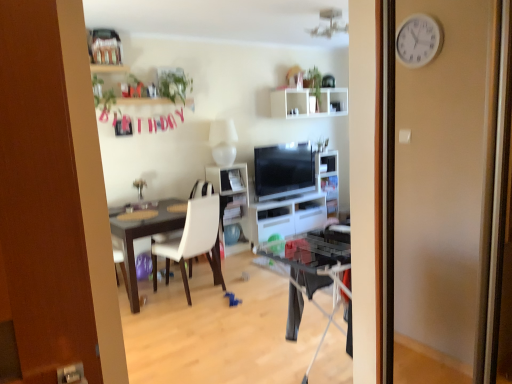
Describe the element at coordinates (174, 85) in the screenshot. I see `green leafy plant at upper center` at that location.

The height and width of the screenshot is (384, 512). What do you see at coordinates (286, 217) in the screenshot?
I see `white glossy cabinet at center` at bounding box center [286, 217].

Image resolution: width=512 pixels, height=384 pixels. What do you see at coordinates (284, 170) in the screenshot?
I see `matte black tv at center` at bounding box center [284, 170].

I want to click on white matte shelf at upper center, arranged as the first shelf when viewed from the back, so click(308, 103).

At what (x,y) coordinates should I click in order to perform the action: click on cabinetry on the left of white matte shelf at upper center, the second shelf viewed from the front. Please return your answer as a coordinate pair (x, y). The height and width of the screenshot is (384, 512). Looking at the image, I should click on (286, 217).

Is white glossy cabinet at center directly adjacent to white matte shelf at upper center, placed as the 1th shelf when sorted from top to bottom?

No, white glossy cabinet at center is not in contact with white matte shelf at upper center, placed as the 1th shelf when sorted from top to bottom.

From a real-world perspective, is white glossy cabinet at center located higher than white matte shelf at upper center, arranged as the first shelf when viewed from the back?

No, from a real-world perspective, white glossy cabinet at center is not above white matte shelf at upper center, arranged as the first shelf when viewed from the back.

From the image's perspective, between green leafy plant at upper center and matte black tv at center, who is located below?

matte black tv at center is shown below in the image.

Is green leafy plant at upper center positioned with its back to matte black tv at center?

green leafy plant at upper center does not have its back to matte black tv at center.

The width and height of the screenshot is (512, 384). I want to click on plant that appears above the matte black tv at center (from the image's perspective), so click(x=174, y=85).

From a real-world perspective, relative to matte black tv at center, is green leafy plant at upper center vertically above or below?

green leafy plant at upper center is situated higher than matte black tv at center in the real world.

How many degrees apart are the facing directions of white matte chair at center and white matte shelf at upper center, the first shelf viewed from the right?

They differ by 172 degrees in their facing directions.

Does white matte chair at center have a larger size compared to white matte shelf at upper center, marked as the 2th shelf in a left-to-right arrangement?

Correct, white matte chair at center is larger in size than white matte shelf at upper center, marked as the 2th shelf in a left-to-right arrangement.

From the image's perspective, which is above, white matte chair at center or white matte shelf at upper center, the first shelf viewed from the right?

From the image's view, white matte shelf at upper center, the first shelf viewed from the right, is above.

Is white matte chair at center not inside white matte shelf at upper center, marked as the 2th shelf in a bottom-to-top arrangement?

white matte chair at center lies outside white matte shelf at upper center, marked as the 2th shelf in a bottom-to-top arrangement,'s area.

From the image's perspective, between white matte chair at center and white glossy cabinet at center, who is located below?

white matte chair at center, from the image's perspective.

From the picture: Between white matte chair at center and white glossy cabinet at center, which one has more height?

white matte chair at center.

Which of these two, white matte chair at center or white glossy cabinet at center, is smaller?

Smaller between the two is white matte chair at center.

Locate an element on the screen. chair that appears on the left of white glossy cabinet at center is located at coordinates (193, 241).

Considering the relative positions of green leafy plant at upper center and white glossy cabinet at center in the image provided, is green leafy plant at upper center to the left or to the right of white glossy cabinet at center?

Clearly, green leafy plant at upper center is on the left of white glossy cabinet at center in the image.

Identify the location of cabinetry behind the green leafy plant at upper center. This screenshot has height=384, width=512. (286, 217).

Could you tell me if green leafy plant at upper center is turned towards white glossy cabinet at center?

No, green leafy plant at upper center is not facing towards white glossy cabinet at center.

Is white matte chair at center positioned in front of white glossy shelf at center, which is the first shelf from left to right?

Yes.

You are a GUI agent. You are given a task and a screenshot of the screen. Output one action in this format:
    pyautogui.click(x=<x>, y=<y>)
    Task: Click on the chair below the white glossy shelf at center, positioned as the 1th shelf in front-to-back order (from a real-world perspective)
    This screenshot has width=512, height=384.
    Given the screenshot: What is the action you would take?
    pyautogui.click(x=193, y=241)

Is white matte chair at center to the left or to the right of white glossy shelf at center, acting as the 1th shelf starting from the bottom, in the image?

white matte chair at center is to the left of white glossy shelf at center, acting as the 1th shelf starting from the bottom.

From a real-world perspective, is white matte chair at center on top of white glossy shelf at center, positioned as the 1th shelf in front-to-back order?

No, from a real-world perspective, white matte chair at center is not on top of white glossy shelf at center, positioned as the 1th shelf in front-to-back order.

Considering the sizes of white matte shelf at upper center, marked as the 2th shelf in a bottom-to-top arrangement, and white matte chair at center in the image, is white matte shelf at upper center, marked as the 2th shelf in a bottom-to-top arrangement, bigger or smaller than white matte chair at center?

Considering their sizes, white matte shelf at upper center, marked as the 2th shelf in a bottom-to-top arrangement, takes up less space than white matte chair at center.

Which is behind, point (342, 100) or point (187, 285)?

The point (342, 100) is farther from the camera.

From the image's perspective, which one is positioned lower, white matte shelf at upper center, marked as the 2th shelf in a left-to-right arrangement, or white matte chair at center?

white matte chair at center is shown below in the image.

The image size is (512, 384). Identify the location of cabinetry on the left of white matte shelf at upper center, placed as the 1th shelf when sorted from top to bottom. (286, 217).

Where is `television behind the green leafy plant at upper center`? The width and height of the screenshot is (512, 384). television behind the green leafy plant at upper center is located at coordinates (284, 170).

Based on their spatial positions, is green leafy plant at upper center or white glossy cabinet at center closer to matte black tv at center?

Among the two, white glossy cabinet at center is located nearer to matte black tv at center.

Based on the photo, when comparing their distances from white glossy shelf at center, positioned as the 1th shelf in front-to-back order, does matte black tv at center or white matte shelf at upper center, placed as the 1th shelf when sorted from top to bottom, seem closer?

Among the two, matte black tv at center is located nearer to white glossy shelf at center, positioned as the 1th shelf in front-to-back order.

Considering their positions, is white matte shelf at upper center, placed as the 1th shelf when sorted from top to bottom, positioned closer to white matte chair at center than green leafy plant at upper center?

Based on the image, green leafy plant at upper center appears to be nearer to white matte chair at center.

When comparing their distances from white glossy cabinet at center, does matte black tv at center or white matte shelf at upper center, the first shelf viewed from the right, seem closer?

Among the two, matte black tv at center is located nearer to white glossy cabinet at center.

Which object lies nearer to the anchor point white matte shelf at upper center, marked as the 2th shelf in a left-to-right arrangement, white glossy shelf at center, which is the second shelf in right-to-left order, or green leafy plant at upper center?

Based on the image, white glossy shelf at center, which is the second shelf in right-to-left order, appears to be nearer to white matte shelf at upper center, marked as the 2th shelf in a left-to-right arrangement.

When comparing their distances from green leafy plant at upper center, does white glossy shelf at center, which is the first shelf from left to right, or white matte chair at center seem further?

white matte chair at center is positioned further to the anchor green leafy plant at upper center.

Looking at the image, which one is located closer to white matte chair at center, white matte shelf at upper center, placed as the 1th shelf when sorted from top to bottom, or matte black tv at center?

matte black tv at center.

Looking at the image, which one is located closer to green leafy plant at upper center, white matte shelf at upper center, marked as the 2th shelf in a left-to-right arrangement, or matte black tv at center?

matte black tv at center.

The image size is (512, 384). Identify the location of television that lies between green leafy plant at upper center and white glossy cabinet at center from top to bottom. (284, 170).

Where is `cabinetry positioned between white matte chair at center and white matte shelf at upper center, the first shelf viewed from the right, from near to far`? cabinetry positioned between white matte chair at center and white matte shelf at upper center, the first shelf viewed from the right, from near to far is located at coordinates (286, 217).

The height and width of the screenshot is (384, 512). What are the coordinates of `shelf located between white matte chair at center and white matte shelf at upper center, placed as the 1th shelf when sorted from top to bottom, in the depth direction` in the screenshot? It's located at (232, 200).

The image size is (512, 384). I want to click on cabinetry situated between white glossy shelf at center, which ranks as the 2th shelf in back-to-front order, and matte black tv at center from left to right, so click(x=286, y=217).